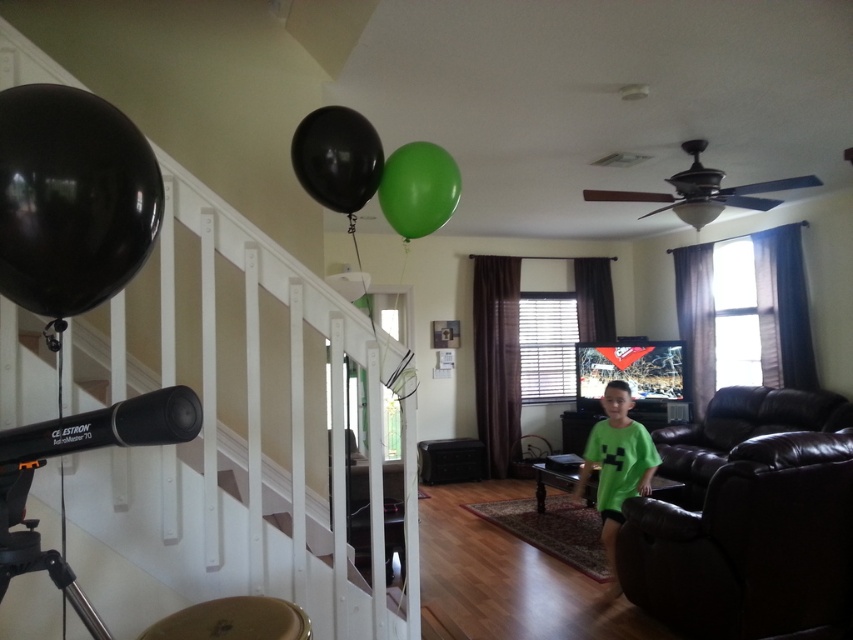
Question: Is black rubber balloon at upper center positioned at the back of green rubber balloon at upper center?

Choices:
 (A) no
 (B) yes

Answer: (A)

Question: Considering the real-world distances, which object is closest to the black rubber balloon at left?

Choices:
 (A) black rubber balloon at upper center
 (B) green rubber balloon at upper center

Answer: (A)

Question: Is black rubber balloon at left to the left of black rubber balloon at upper center from the viewer's perspective?

Choices:
 (A) no
 (B) yes

Answer: (B)

Question: Which object appears farthest from the camera in this image?

Choices:
 (A) green rubber balloon at upper center
 (B) green matte shirt at lower center

Answer: (B)

Question: Is black rubber balloon at left in front of black matte tripod at lower left?

Choices:
 (A) yes
 (B) no

Answer: (A)

Question: Which object appears farthest from the camera in this image?

Choices:
 (A) green rubber balloon at upper center
 (B) green matte shirt at lower center

Answer: (B)